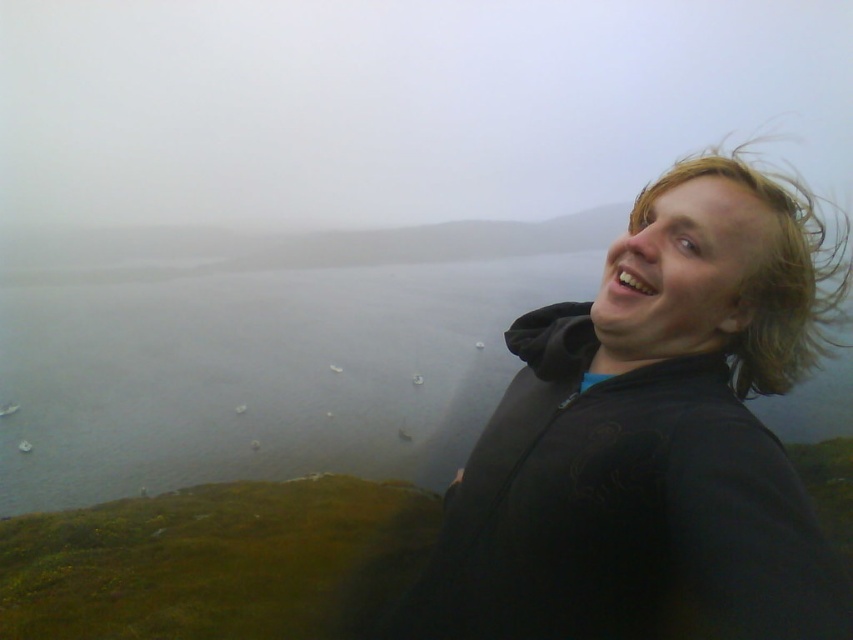
Based on the photo, you are a photographer trying to capture the perfect shot of the person in the scene. You need to ensure that both the black matte jacket at upper right and the blondehair texture at right are clearly visible in the frame. Given their sizes, which object should you focus on first to ensure both are in focus?

The black matte jacket at upper right has a larger size compared to blondehair texture at right. To ensure both are in focus, you should focus on the larger object first, which is the black matte jacket at upper right, as it will require more precise focusing due to its size.

You are a photographer trying to capture the perfect shot of the person in the scene. You notice the black matte jacket at upper right and the blondehair texture at right. Which object should you focus on first to ensure both are in sharp focus, considering their positions?

The black matte jacket at upper right is in front of the blondehair texture at right, so focusing on the black matte jacket at upper right first will ensure both are in sharp focus as the background object will still be in focus due to its proximity.